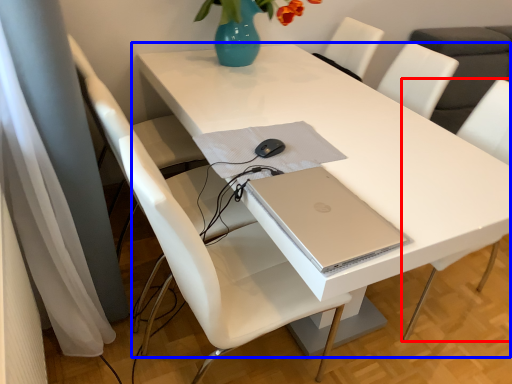
Question: Which of the following is the farthest to the observer, chair (highlighted by a red box) or table (highlighted by a blue box)?

Choices:
 (A) chair
 (B) table

Answer: (A)